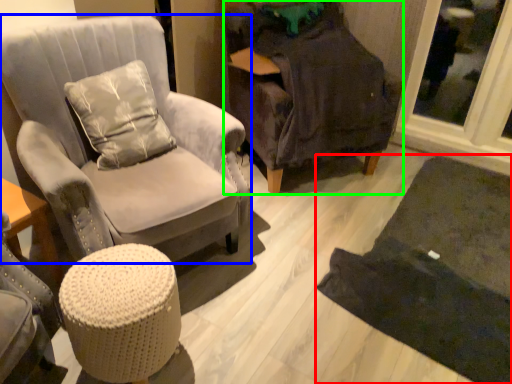
Question: Estimate the real-world distances between objects in this image. Which object is closer to mat (highlighted by a red box), chair (highlighted by a blue box) or chair (highlighted by a green box)?

Choices:
 (A) chair
 (B) chair

Answer: (B)